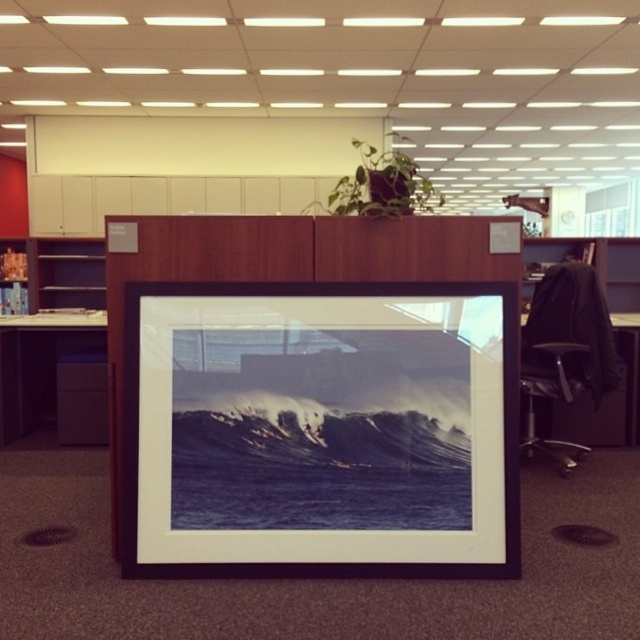
You are a delivery person standing at the entrance of the office. You need to place a package on the desk behind the black matte picture frame at center. The package is 10 feet long. Is there enough space behind the frame to place the package horizontally?

The distance of black matte picture frame at center from camera is 8.12 feet. Since the package is 10 feet long, which is longer than the available space behind the frame, the package cannot be placed horizontally there.

You are standing in the office and looking at the cubicle setup. There are two points marked in the scene. Which point is closer to you, point (173, 394) or point (54, 413)?

Point (173, 394) is closer to the camera than point (54, 413).

You are organizing a meeting in the office and need to place two tables. The matte black table at lower left and the black leather table at right are available. Which table should you choose if you need more space for documents?

The matte black table at lower left is bigger than the black leather table at right, so you should choose the matte black table at lower left for more space.